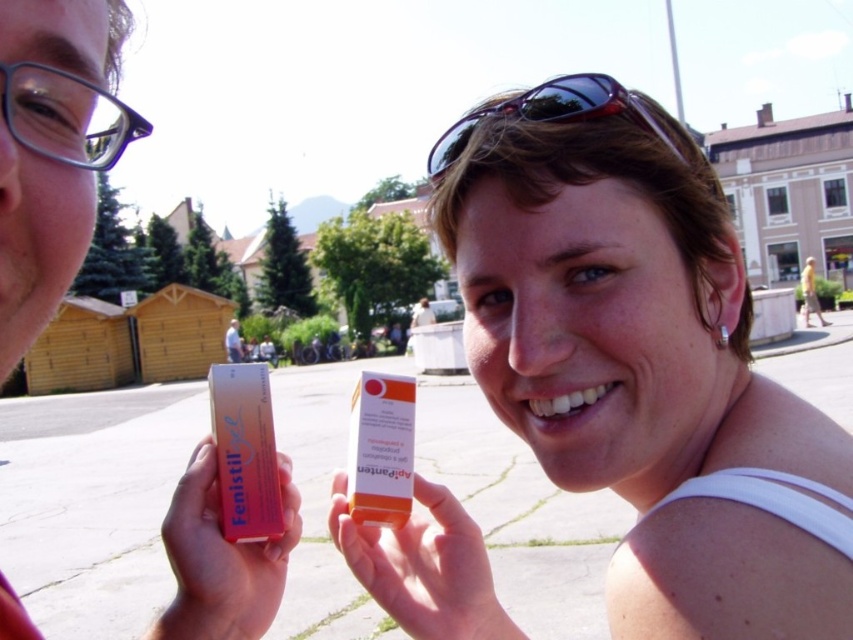
Question: Is matte plastic box at left positioned in front of clear plastic glasses at upper left?

Choices:
 (A) no
 (B) yes

Answer: (B)

Question: Does orange plastic box at center have a smaller size compared to orange plastic tube at center?

Choices:
 (A) no
 (B) yes

Answer: (A)

Question: Which of the following is the closest to the observer?

Choices:
 (A) click(207, 584)
 (B) click(271, 547)
 (C) click(125, 141)
 (D) click(657, 614)

Answer: (A)

Question: Which object appears closest to the camera in this image?

Choices:
 (A) orange plastic box at center
 (B) matte plastic box at lower left
 (C) matte plastic box at left
 (D) orange plastic tube at center

Answer: (C)

Question: Can you confirm if orange plastic tube at center is wider than shiny purple sunglasses at upper center?

Choices:
 (A) no
 (B) yes

Answer: (A)

Question: Which object is the farthest from the orange plastic box at center?

Choices:
 (A) matte plastic box at lower left
 (B) orange plastic tube at center

Answer: (A)